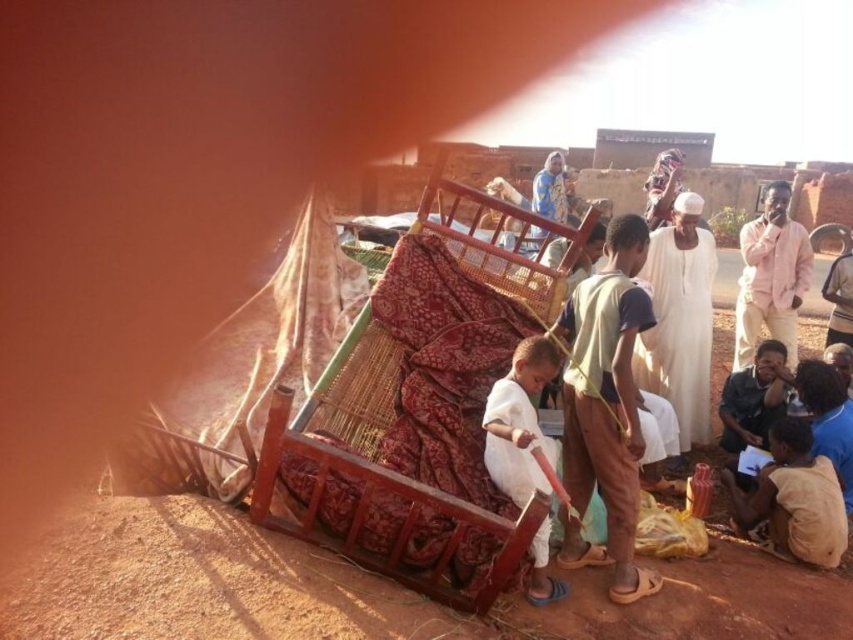
You are planning to take a photo of the brown dirt field at lower center and the pink cotton shirt at upper right. Which object should you focus on first if you want to capture both in a single frame without moving the camera?

You should focus on the pink cotton shirt at upper right first because it occupies more space in the frame than the brown dirt field at lower center, ensuring it is properly in focus before adjusting for the smaller area.

You are a photographer trying to capture the light brown fabric at lower right and the brown dirt field at lower center in the same frame. Based on their positions, can you determine which one is closer to the camera?

The light brown fabric at lower right is closer to the camera because the brown dirt field at lower center is positioned under it.

You are a photographer trying to capture the scene of the people around the bed. You notice the brown dirt field at lower center and the light brown fabric at lower right in your frame. Which object appears closer to the camera based on their heights in the image?

The light brown fabric at lower right appears closer to the camera because it has a greater height than the brown dirt field at lower center.